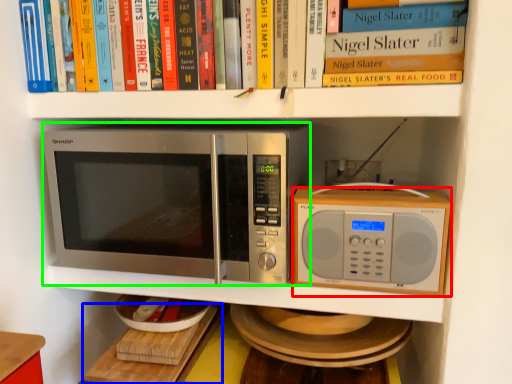
Question: Which object is positioned farthest from microwave oven (highlighted by a red box)? Select from table (highlighted by a blue box) and microwave oven (highlighted by a green box).

Choices:
 (A) table
 (B) microwave oven

Answer: (A)